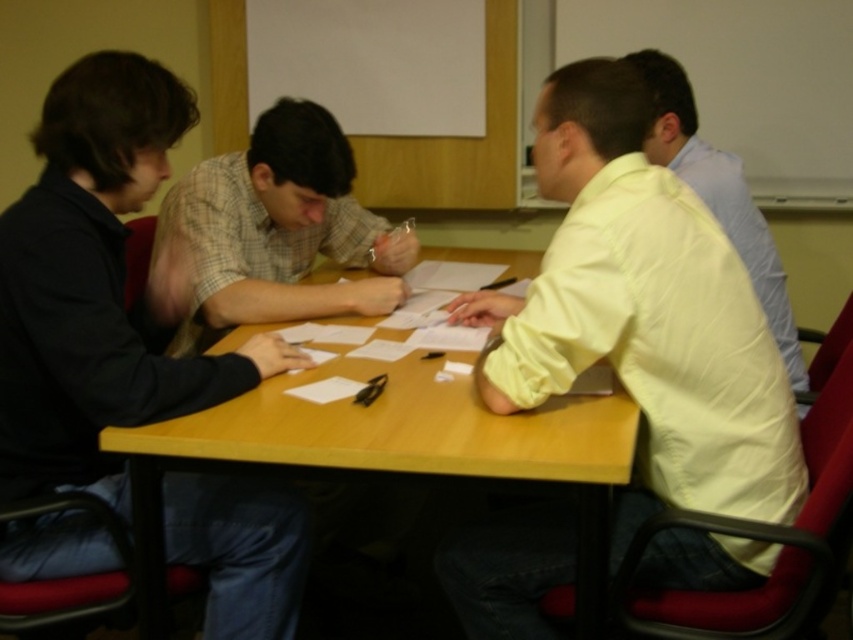
Does point (223, 492) lie behind point (583, 493)?

Yes, it is behind point (583, 493).

Does black matte shirt at left appear over wooden table at center?

Yes.

Image resolution: width=853 pixels, height=640 pixels. What do you see at coordinates (100, 288) in the screenshot?
I see `black matte shirt at left` at bounding box center [100, 288].

Where is `black matte shirt at left`? The width and height of the screenshot is (853, 640). black matte shirt at left is located at coordinates (100, 288).

In the scene shown: Between wooden table at center and yellow satin shirt at right, which one appears on the left side from the viewer's perspective?

From the viewer's perspective, wooden table at center appears more on the left side.

How distant is wooden table at center from yellow satin shirt at right?

The distance of wooden table at center from yellow satin shirt at right is 34.45 inches.

Is point (462, 400) positioned behind point (770, 266)?

No.

What are the coordinates of `wooden table at center` in the screenshot? It's located at (392, 452).

Can you confirm if light yellow shirt at upper right is wider than wooden table at center?

In fact, light yellow shirt at upper right might be narrower than wooden table at center.

Does point (514, 580) lie in front of point (428, 467)?

No, it is not.

Who is more distant from viewer, (683, 308) or (137, 557)?

Positioned behind is point (137, 557).

Where is `light yellow shirt at upper right`? light yellow shirt at upper right is located at coordinates (643, 314).